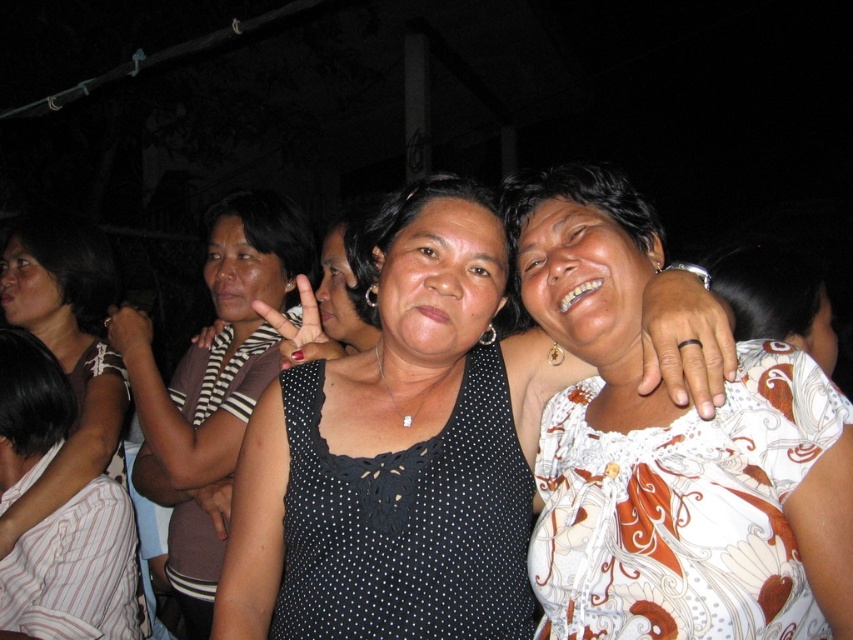
Between point (636, 444) and point (231, 272), which one is positioned in front?

Point (636, 444) is more forward.

Is point (543, 458) positioned in front of point (254, 374)?

Yes.

The height and width of the screenshot is (640, 853). I want to click on white printed fabric dress at center, so click(x=683, y=509).

Who is more distant from viewer, (238,204) or (108,458)?

The point (238,204) is more distant.

Does point (192, 588) come in front of point (25, 243)?

Yes, it is.

Image resolution: width=853 pixels, height=640 pixels. Describe the element at coordinates (213, 385) in the screenshot. I see `matte black dress at center` at that location.

You are a GUI agent. You are given a task and a screenshot of the screen. Output one action in this format:
    pyautogui.click(x=<x>, y=<y>)
    Task: Click on the matte black dress at center
    The height and width of the screenshot is (640, 853).
    Given the screenshot: What is the action you would take?
    pyautogui.click(x=213, y=385)

Which of these two, black dotted fabric dress at center or striped fabric dress at center, stands shorter?

black dotted fabric dress at center is shorter.

How distant is black dotted fabric dress at center from striped fabric dress at center?

black dotted fabric dress at center is 1.08 meters from striped fabric dress at center.

Is point (480, 394) closer to viewer compared to point (97, 346)?

Yes, it is.

Find the location of a particular element. The image size is (853, 640). black dotted fabric dress at center is located at coordinates (407, 522).